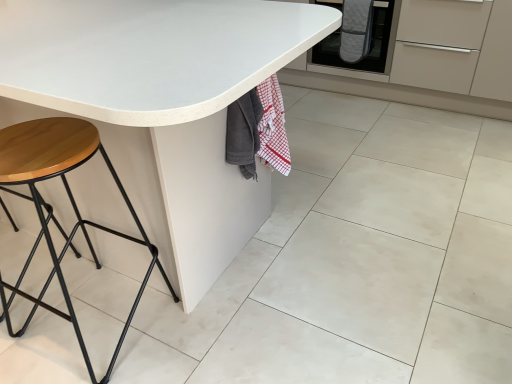
Question: Is white matte granite at center far from white matte table at center?

Choices:
 (A) no
 (B) yes

Answer: (A)

Question: Is white matte table at center at the back of white matte granite at center?

Choices:
 (A) no
 (B) yes

Answer: (A)

Question: Is white matte granite at center shorter than white matte table at center?

Choices:
 (A) yes
 (B) no

Answer: (A)

Question: Can you confirm if white matte granite at center is thinner than white matte table at center?

Choices:
 (A) no
 (B) yes

Answer: (B)

Question: Is white matte granite at center bigger than white matte table at center?

Choices:
 (A) no
 (B) yes

Answer: (A)

Question: From a real-world perspective, is white matte granite at center physically above white matte table at center?

Choices:
 (A) no
 (B) yes

Answer: (A)

Question: Does white matte table at center contain quilted gray oven mitts at center?

Choices:
 (A) yes
 (B) no

Answer: (B)

Question: From the image's perspective, is white matte table at center above quilted gray oven mitts at center?

Choices:
 (A) no
 (B) yes

Answer: (A)

Question: Is there a large distance between white matte table at center and quilted gray oven mitts at center?

Choices:
 (A) no
 (B) yes

Answer: (B)

Question: Can you confirm if white matte table at center is positioned to the right of quilted gray oven mitts at center?

Choices:
 (A) yes
 (B) no

Answer: (B)

Question: Considering the relative positions of white matte table at center and quilted gray oven mitts at center in the image provided, is white matte table at center behind quilted gray oven mitts at center?

Choices:
 (A) yes
 (B) no

Answer: (B)

Question: Can you confirm if white matte table at center is shorter than quilted gray oven mitts at center?

Choices:
 (A) yes
 (B) no

Answer: (B)

Question: Considering the relative positions of white matte granite at center and quilted gray oven mitts at center in the image provided, is white matte granite at center to the left of quilted gray oven mitts at center from the viewer's perspective?

Choices:
 (A) yes
 (B) no

Answer: (A)